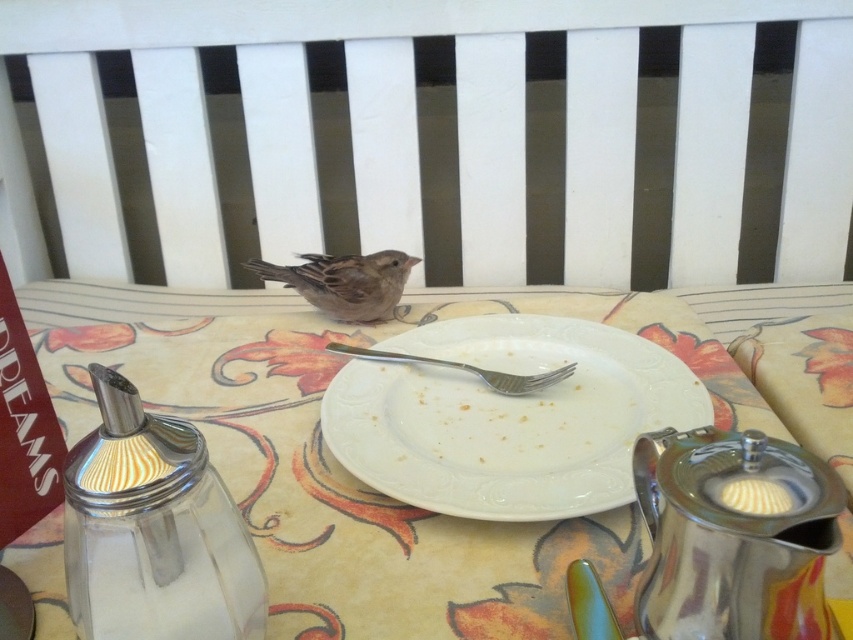
Which of these two, white ceramic plate at center or white porcelain plate at center, stands taller?

A: With more height is white ceramic plate at center.

Is white ceramic plate at center to the left of white porcelain plate at center from the viewer's perspective?

Yes, white ceramic plate at center is to the left of white porcelain plate at center.

Identify the location of white ceramic plate at center. (341, 468).

Can you confirm if white ceramic plate at center is smaller than brown feathered sparrow at center?

No, white ceramic plate at center is not smaller than brown feathered sparrow at center.

Which is more to the right, white ceramic plate at center or brown feathered sparrow at center?

Positioned to the right is white ceramic plate at center.

Between point (247, 413) and point (363, 278), which one is positioned in front?

Point (247, 413)

The height and width of the screenshot is (640, 853). Find the location of `white ceramic plate at center`. white ceramic plate at center is located at coordinates (341, 468).

Can you confirm if white porcelain plate at center is taller than brown feathered sparrow at center?

Yes, white porcelain plate at center is taller than brown feathered sparrow at center.

Does white porcelain plate at center appear over brown feathered sparrow at center?

Incorrect, white porcelain plate at center is not positioned above brown feathered sparrow at center.

Which is behind, point (592, 388) or point (281, 266)?

Positioned behind is point (281, 266).

Locate an element on the screen. white porcelain plate at center is located at coordinates (508, 417).